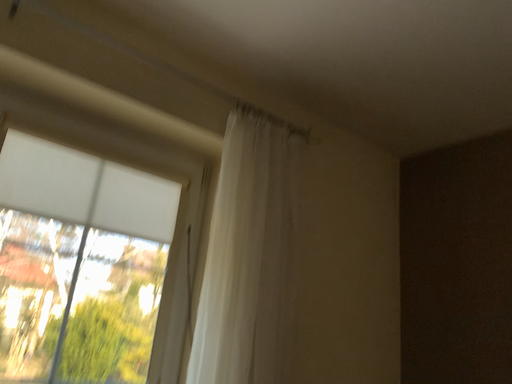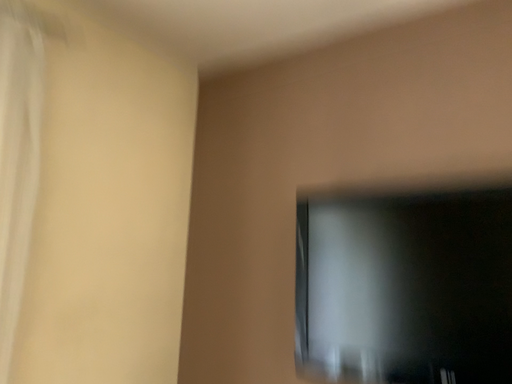
Question: How did the camera likely rotate when shooting the video?

Choices:
 (A) rotated downward
 (B) rotated upward

Answer: (A)